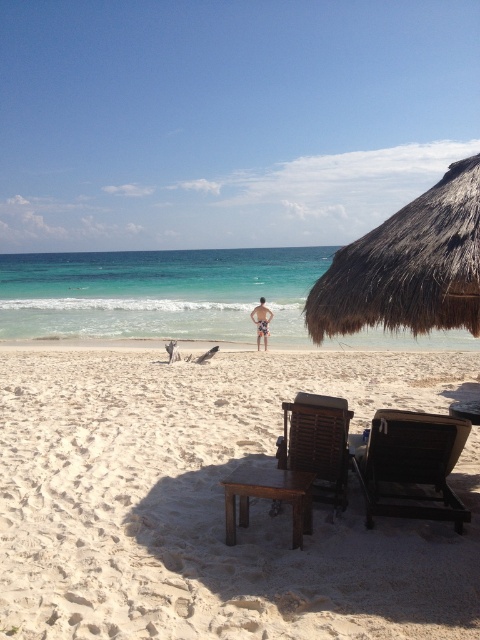
Between white sandy beach at center and brown thatch umbrella at upper right, which one has more height?

brown thatch umbrella at upper right

Is white sandy beach at center shorter than brown thatch umbrella at upper right?

Yes.

Locate an element on the screen. This screenshot has width=480, height=640. white sandy beach at center is located at coordinates (212, 500).

Find the location of a particular element. The height and width of the screenshot is (640, 480). white sandy beach at center is located at coordinates (212, 500).

Between brown thatch umbrella at upper right and black plastic beach chair at lower right, which one has less height?

With less height is black plastic beach chair at lower right.

You are a GUI agent. You are given a task and a screenshot of the screen. Output one action in this format:
    pyautogui.click(x=<x>, y=<y>)
    Task: Click on the brown thatch umbrella at upper right
    This screenshot has width=480, height=640.
    Given the screenshot: What is the action you would take?
    pyautogui.click(x=408, y=266)

Where is `brown thatch umbrella at upper right`? brown thatch umbrella at upper right is located at coordinates (408, 266).

Which is above, white sandy beach at center or brown wooden stool at center?

white sandy beach at center is higher up.

Between white sandy beach at center and brown wooden stool at center, which one has more height?

white sandy beach at center

Describe the element at coordinates (212, 500) in the screenshot. The image size is (480, 640). I see `white sandy beach at center` at that location.

Find the location of `white sandy beach at center`. white sandy beach at center is located at coordinates (212, 500).